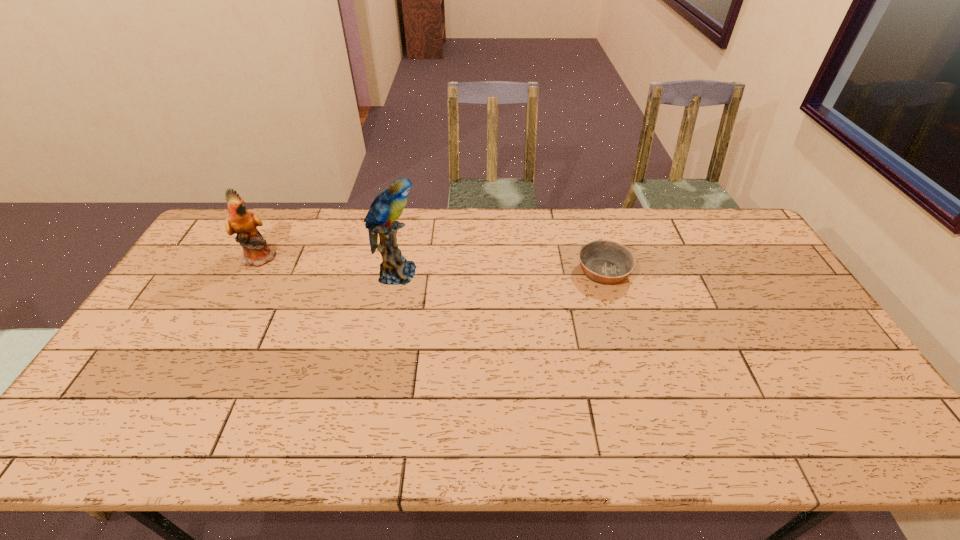
Locate an element on the screen. The height and width of the screenshot is (540, 960). the right parrot is located at coordinates (387, 207).

Where is `the tallest object`? The image size is (960, 540). the tallest object is located at coordinates (387, 207).

This screenshot has width=960, height=540. Find the location of `the shorter parrot`. the shorter parrot is located at coordinates (256, 252).

Identify the location of the left parrot. The image size is (960, 540). (256, 252).

At what (x,y) coordinates should I click in order to perform the action: click on the shortest object. Please return your answer as a coordinate pair (x, y). This screenshot has width=960, height=540. Looking at the image, I should click on (605, 262).

At what (x,y) coordinates should I click in order to perform the action: click on bowl. Please return your answer as a coordinate pair (x, y). This screenshot has height=540, width=960. Looking at the image, I should click on (605, 262).

Image resolution: width=960 pixels, height=540 pixels. What are the coordinates of `vacant position located 0.320m on the face of the right parrot` in the screenshot? It's located at (523, 273).

The height and width of the screenshot is (540, 960). Find the location of `vacant area situated 0.190m on the front-facing side of the left parrot`. vacant area situated 0.190m on the front-facing side of the left parrot is located at coordinates (335, 257).

Find the location of a particular element. The height and width of the screenshot is (540, 960). blank space located on the right of the shortest object is located at coordinates (744, 272).

Identify the location of object located in the far edge section of the desktop. (256, 252).